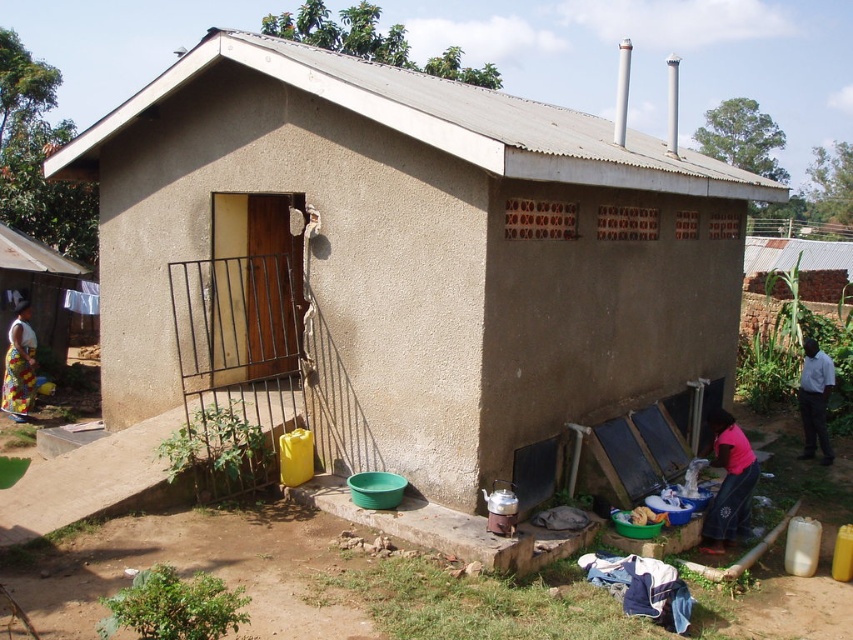
You are standing in front of the building and notice a printed fabric skirt at lower left. Where exactly is the printed fabric skirt located in relation to the building?

The printed fabric skirt at lower left is located at point [19,362] relative to the building.

You are standing in front of the building and see the printed fabric skirt at lower left and the white shirt at right. Which item is positioned more to the left side?

The printed fabric skirt at lower left is positioned to the left of the white shirt at right, so it is more to the left side.

You are standing at the entrance of the building and need to reach both the faded denim jacket at lower right and the white shirt at right. Which item is closer to you?

The faded denim jacket at lower right is 19.16 feet away from the white shirt at right, so the white shirt at right is closer to you.